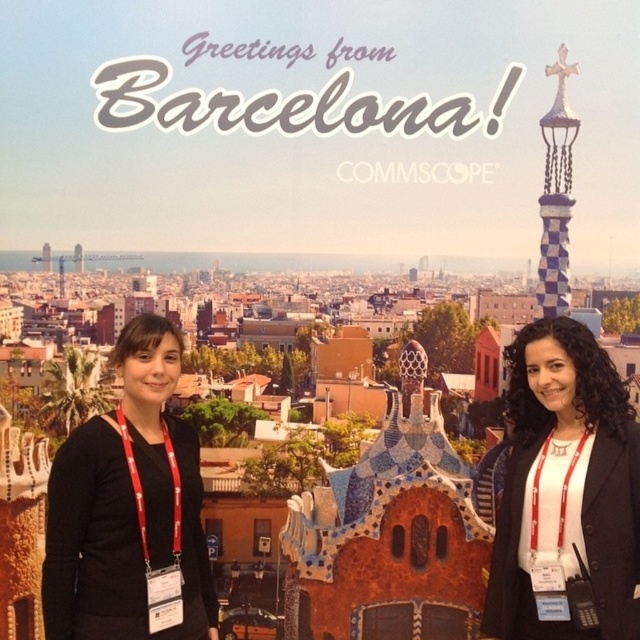
Question: Does black matte jacket at right appear on the left side of black fabric at left?

Choices:
 (A) no
 (B) yes

Answer: (A)

Question: Can you confirm if black matte jacket at right is positioned below black fabric at left?

Choices:
 (A) yes
 (B) no

Answer: (B)

Question: Which point is farther to the camera?

Choices:
 (A) (544, 342)
 (B) (148, 452)

Answer: (A)

Question: Which point is closer to the camera?

Choices:
 (A) [x=573, y=432]
 (B) [x=154, y=401]

Answer: (A)

Question: Is black matte jacket at right positioned at the back of black fabric at left?

Choices:
 (A) no
 (B) yes

Answer: (A)